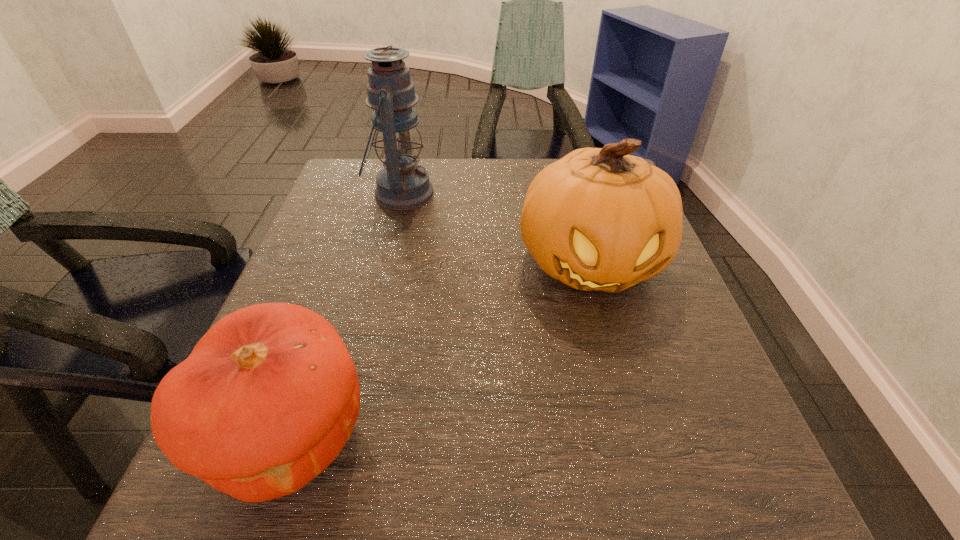
Select which object appears as the second closest to the nearest object. Please provide its 2D coordinates. Your answer should be formatted as a tuple, i.e. [(x, y)], where the tuple contains the x and y coordinates of a point satisfying the conditions above.

[(402, 185)]

At what (x,y) coordinates should I click in order to perform the action: click on the second closest object to the farthest object. Please return your answer as a coordinate pair (x, y). This screenshot has height=540, width=960. Looking at the image, I should click on (269, 396).

At what (x,y) coordinates should I click in order to perform the action: click on free spot that satisfies the following two spatial constraints: 1. on the front-facing side of the farthest object; 2. on the front side of the left pumpkin. Please return your answer as a coordinate pair (x, y). The image size is (960, 540). Looking at the image, I should click on (344, 435).